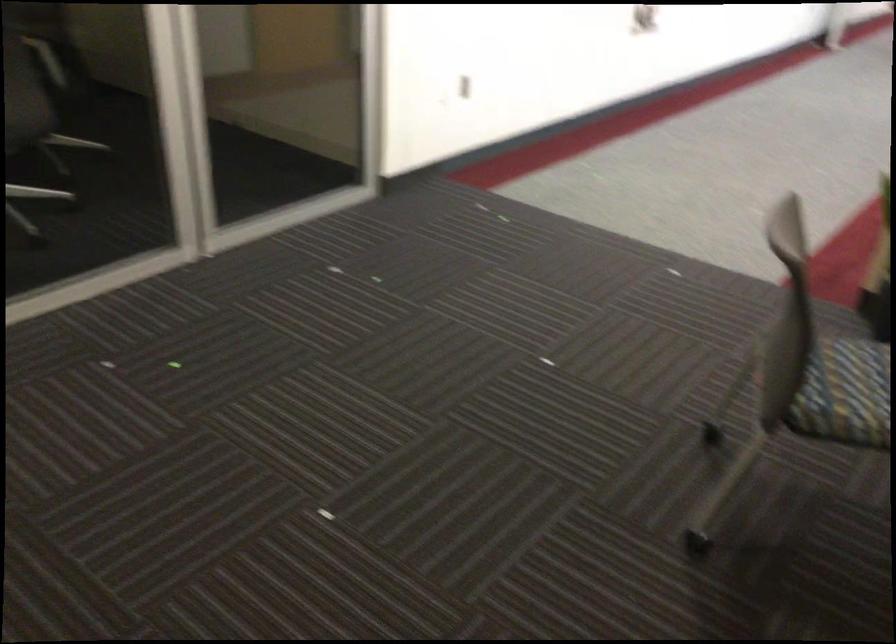
Identify the location of patterned chair sitting surface. (845, 393).